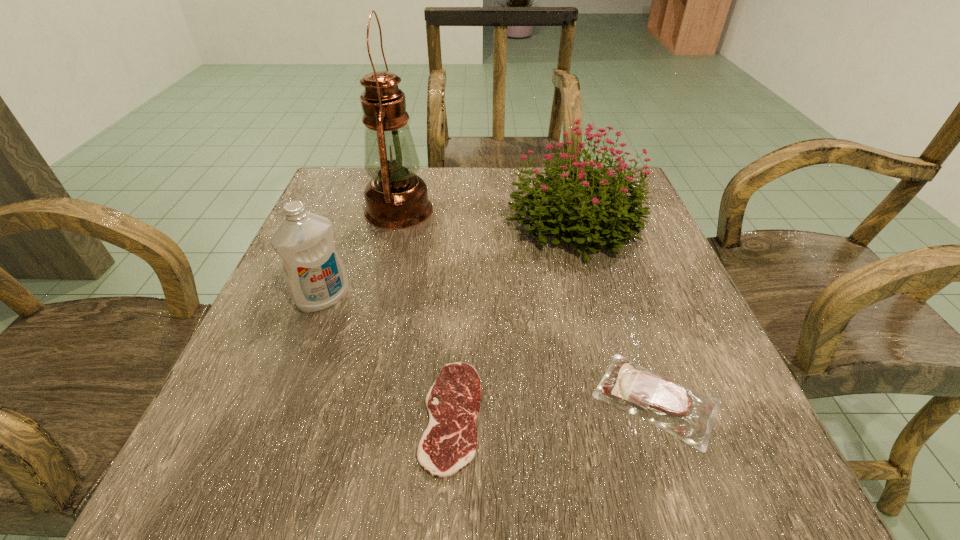
The height and width of the screenshot is (540, 960). Identify the location of the tallest object. (396, 198).

In order to click on bouquet in this screenshot , I will do `click(583, 215)`.

At what (x,y) coordinates should I click in order to perform the action: click on detergent. Please return your answer as a coordinate pair (x, y). Looking at the image, I should click on (315, 276).

At what (x,y) coordinates should I click in order to perform the action: click on the fourth tallest object. Please return your answer as a coordinate pair (x, y). This screenshot has width=960, height=540. Looking at the image, I should click on (663, 402).

This screenshot has height=540, width=960. In order to click on the right steak in this screenshot , I will do `click(663, 402)`.

I want to click on the shorter steak, so click(x=449, y=443).

Locate an element on the screen. The height and width of the screenshot is (540, 960). the left steak is located at coordinates (449, 443).

At what (x,y) coordinates should I click in order to perform the action: click on free spot located on the front of the oil lamp. Please return your answer as a coordinate pair (x, y). Looking at the image, I should click on pyautogui.click(x=358, y=376).

This screenshot has height=540, width=960. I want to click on free space located 0.320m on the left of the bouquet, so click(358, 222).

At what (x,y) coordinates should I click in order to perform the action: click on free space located on the front of the third farthest object. Please return your answer as a coordinate pair (x, y). This screenshot has width=960, height=540. Looking at the image, I should click on (301, 358).